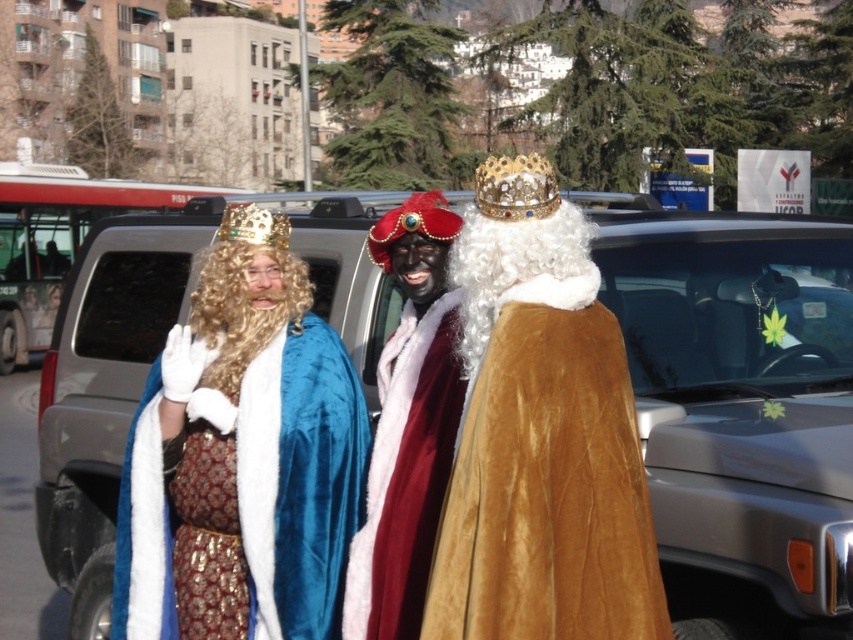
You are a photographer trying to capture a clear shot of both the gold jeweled crown at center and the gold metallic crown at center. Since you want to ensure both are fully visible, which crown should you focus on first to avoid cropping the edges?

The gold jeweled crown at center is wider than the gold metallic crown at center, so you should focus on capturing the gold jeweled crown at center first to ensure its full width fits within the frame before adjusting for the narrower gold metallic crown at center.

You are standing at the camera position and want to take a photo of the gold jeweled crown at center. If your camera has a maximum focus range of 3 meters, will you be able to capture the crown clearly?

The gold jeweled crown at center and camera are 3.15 meters apart from each other. Since the camera can only focus up to 3 meters, it won not be able to capture the crown clearly.